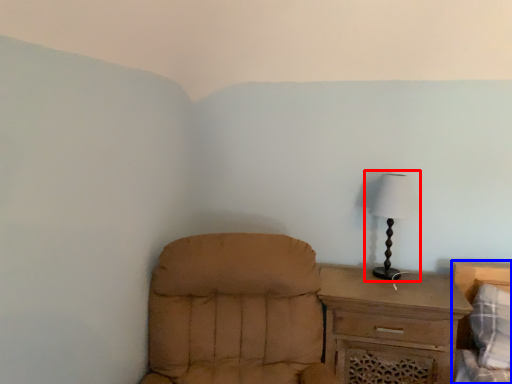
Question: Which object appears closest to the camera in this image, lamp (highlighted by a red box) or bed (highlighted by a blue box)?

Choices:
 (A) lamp
 (B) bed

Answer: (B)